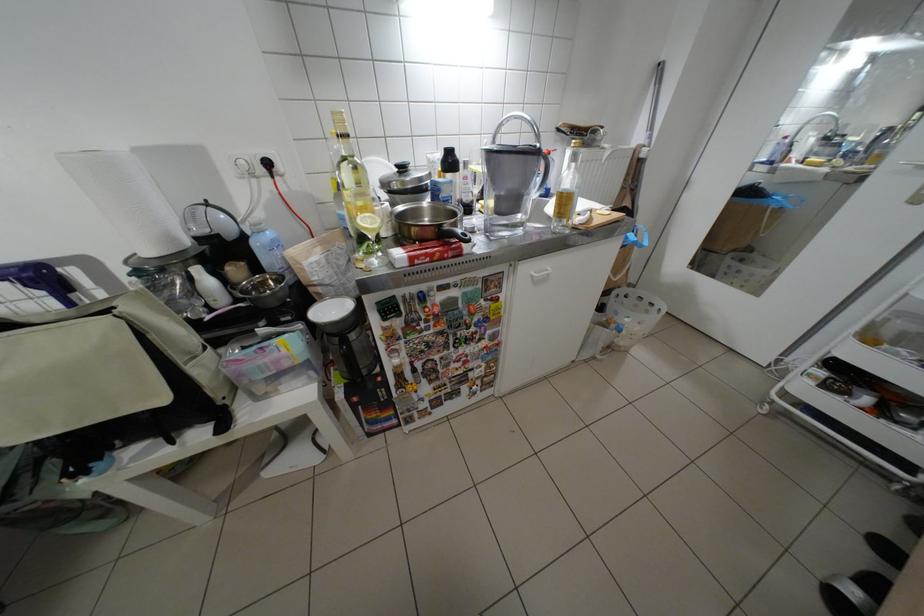
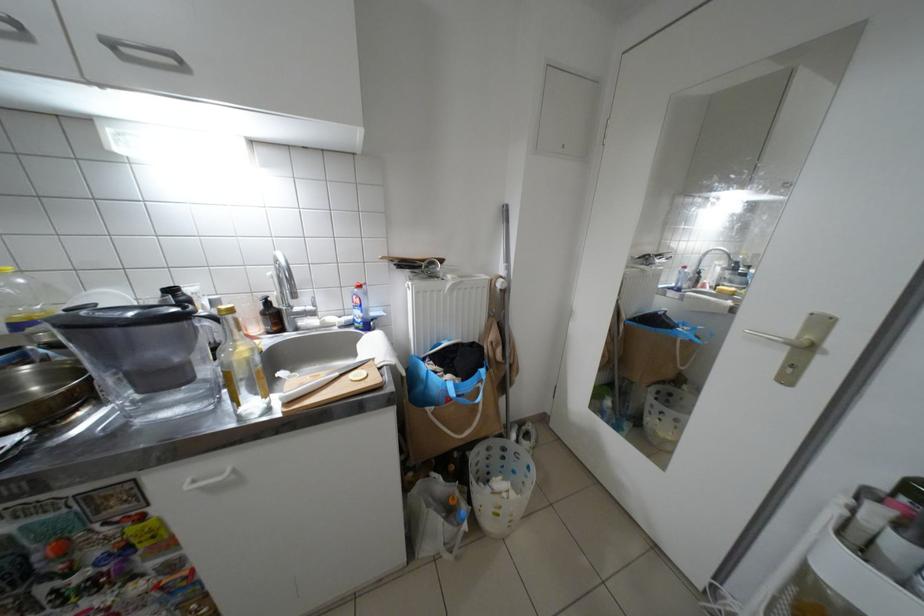
Locate, in the second image, the point that corresponds to the point at 796,139 in the first image.

(697, 269)